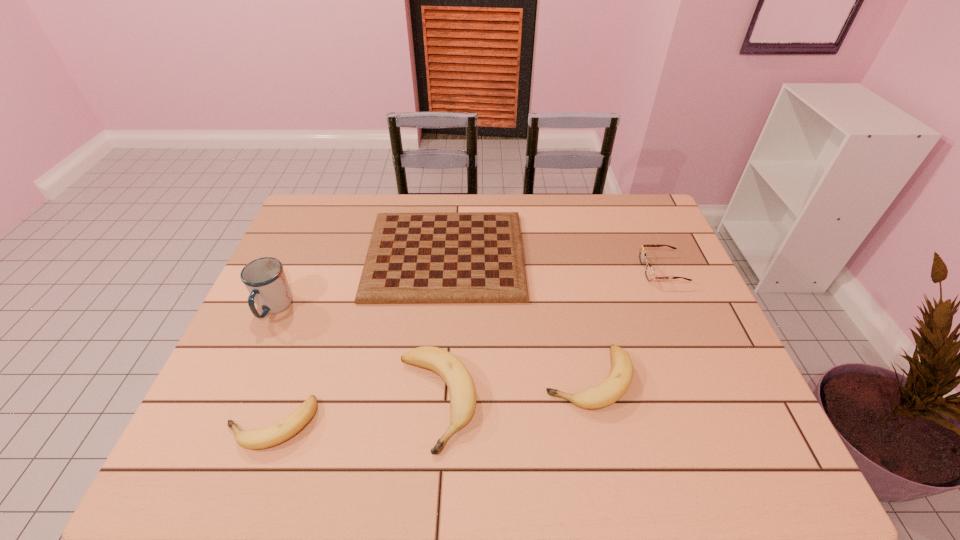
At what (x,y) coordinates should I click in order to perform the action: click on vacant space located on the right of the gameboard. Please return your answer as a coordinate pair (x, y). This screenshot has width=960, height=540. Looking at the image, I should click on (550, 255).

In order to click on vacant area situated on the frame of the spectacles in this screenshot , I will do `click(552, 270)`.

The height and width of the screenshot is (540, 960). In order to click on vacant space located on the frame of the spectacles in this screenshot , I will do `click(522, 270)`.

Locate an element on the screen. Image resolution: width=960 pixels, height=540 pixels. vacant region located on the frame of the spectacles is located at coordinates (522, 270).

Identify the location of vacant space located 0.050m on the handle side of the mug. This screenshot has height=540, width=960. (257, 343).

The image size is (960, 540). What are the coordinates of `object that is at the far edge` in the screenshot? It's located at (453, 257).

Where is `banana present at the left edge`? banana present at the left edge is located at coordinates (254, 439).

Locate an element on the screen. This screenshot has width=960, height=540. mug located at the left edge is located at coordinates (264, 278).

Identify the location of object that is at the right edge. The image size is (960, 540). (649, 273).

This screenshot has height=540, width=960. I want to click on object that is at the near left corner, so click(254, 439).